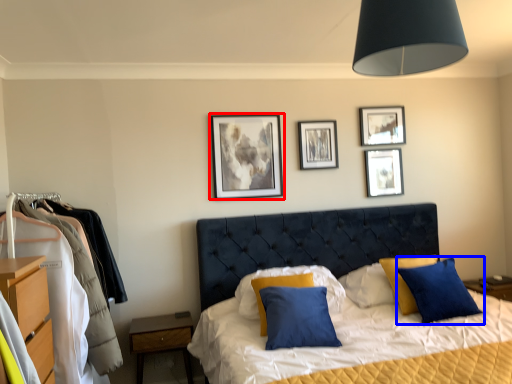
Question: Which of the following is the closest to the observer, picture frame (highlighted by a red box) or pillow (highlighted by a blue box)?

Choices:
 (A) picture frame
 (B) pillow

Answer: (B)